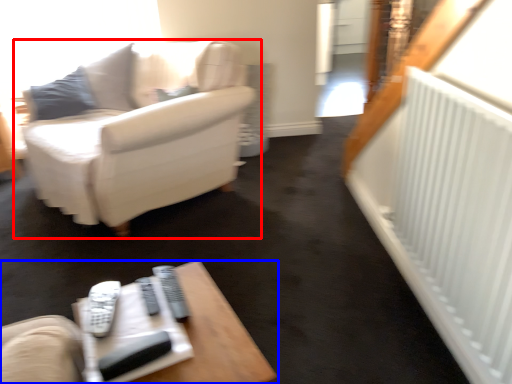
Question: Which object is closer to the camera taking this photo, studio couch (highlighted by a red box) or table (highlighted by a blue box)?

Choices:
 (A) studio couch
 (B) table

Answer: (B)